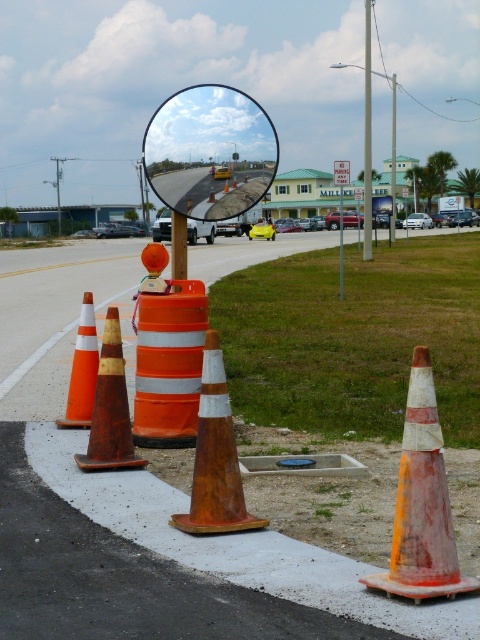
Question: Can you confirm if orange reflective cone at left is positioned to the right of orange/reflective traffic cone at center?

Choices:
 (A) no
 (B) yes

Answer: (A)

Question: Does orange reflective cone at lower right come behind orange reflective barrel at center?

Choices:
 (A) yes
 (B) no

Answer: (B)

Question: Based on their relative distances, which object is nearer to the orange plastic pole at center?

Choices:
 (A) orange reflective barrel at center
 (B) orange reflective cone at lower left

Answer: (A)

Question: In this image, where is white painted curb at lower center located relative to reflective glass mirror at center?

Choices:
 (A) below
 (B) above

Answer: (A)

Question: Which of the following is the farthest from the observer?

Choices:
 (A) (363, 172)
 (B) (215, 442)
 (C) (176, 268)

Answer: (A)

Question: Which object appears closest to the camera in this image?

Choices:
 (A) reflective glass mirror at center
 (B) brushed metal pole at upper center
 (C) orange reflective cone at lower right

Answer: (C)